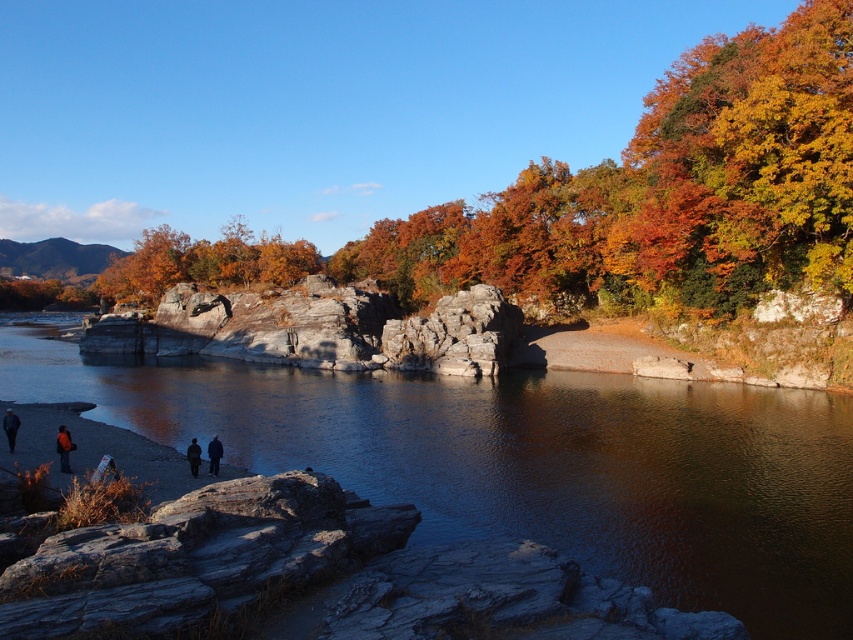
Question: Is dark blue fabric jacket at lower left wider than dark wool coat at center?

Choices:
 (A) no
 (B) yes

Answer: (B)

Question: From the image, what is the correct spatial relationship of orange matte tree at upper right in relation to dark blue fabric jacket at lower left?

Choices:
 (A) below
 (B) above

Answer: (B)

Question: Estimate the real-world distances between objects in this image. Which object is farther from the orange fabric jacket at lower left?

Choices:
 (A) orange matte tree at upper right
 (B) dark wool coat at center
 (C) smooth gray river at center
 (D) dark blue fabric at lower center

Answer: (A)

Question: Can you confirm if orange matte tree at upper right is positioned below orange fabric jacket at lower left?

Choices:
 (A) no
 (B) yes

Answer: (A)

Question: Which object appears closest to the camera in this image?

Choices:
 (A) smooth gray river at center
 (B) dark blue fabric at lower center
 (C) dark wool coat at center

Answer: (A)

Question: Which point is farther from the camera taking this photo?

Choices:
 (A) (843, 554)
 (B) (198, 458)

Answer: (B)